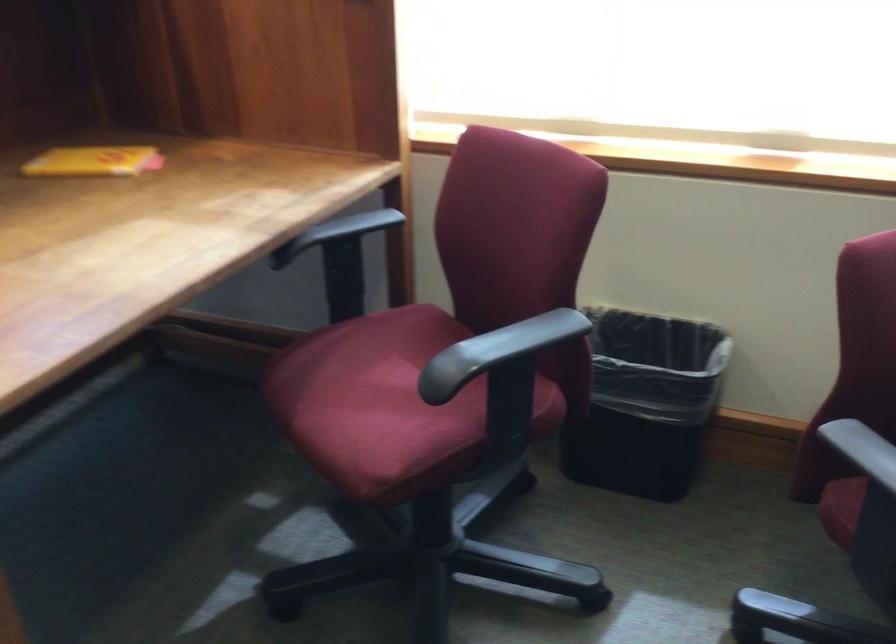
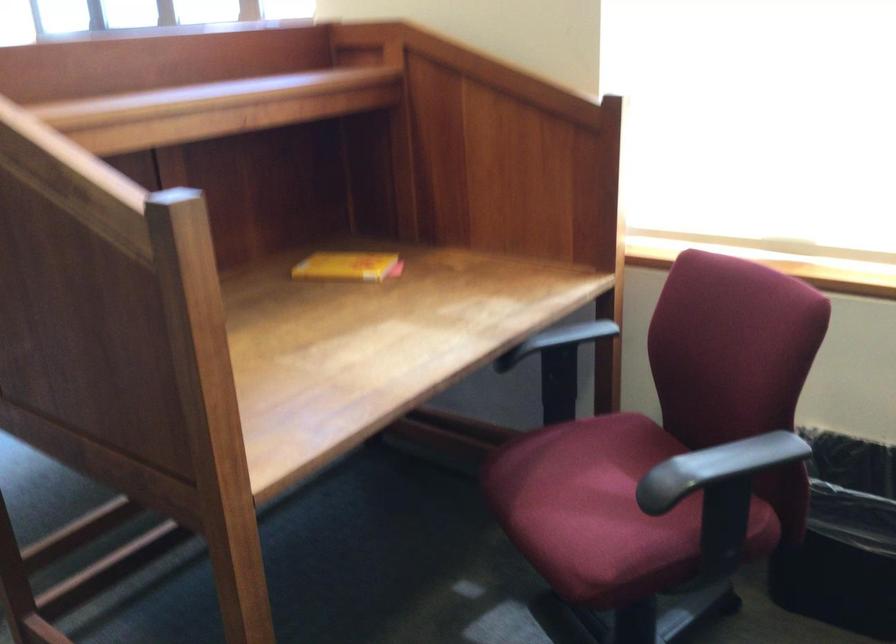
The point at (378, 404) is marked in the first image. Where is the corresponding point in the second image?

(592, 509)